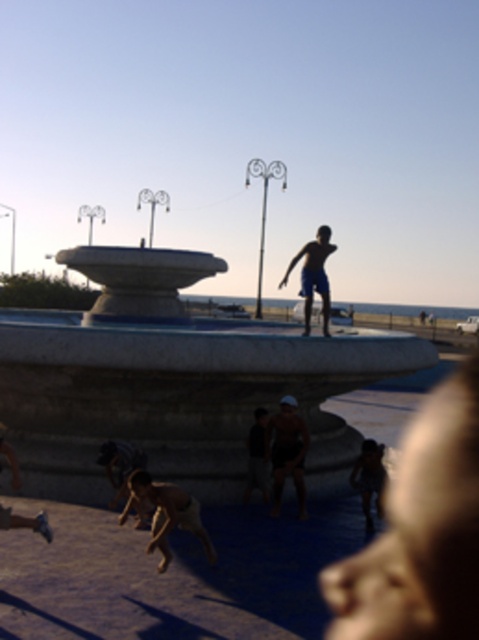
Between white marble fountain at center and dark brown leather shorts at center, which one is positioned lower?

dark brown leather shorts at center is lower down.

Locate an element on the screen. The image size is (479, 640). white marble fountain at center is located at coordinates (172, 381).

Does point (69, 388) lie in front of point (283, 413)?

No, it is not.

Where is `white marble fountain at center`? white marble fountain at center is located at coordinates (172, 381).

From the picture: Does white marble fountain at center have a lesser height compared to blue matte shorts at center?

Correct, white marble fountain at center is not as tall as blue matte shorts at center.

Can you confirm if white marble fountain at center is thinner than blue matte shorts at center?

In fact, white marble fountain at center might be wider than blue matte shorts at center.

Who is more distant from viewer, (341,476) or (319,227)?

Positioned behind is point (319,227).

In order to click on white marble fountain at center in this screenshot , I will do `click(172, 381)`.

Does dark brown leather shorts at center have a smaller size compared to blue matte shorts at center?

No, dark brown leather shorts at center is not smaller than blue matte shorts at center.

Which is in front, point (306, 516) or point (307, 266)?

Point (306, 516) is in front.

Where is `dark brown leather shorts at center`? dark brown leather shorts at center is located at coordinates (287, 451).

Image resolution: width=479 pixels, height=640 pixels. Find the location of `dark brown leather shorts at center`. dark brown leather shorts at center is located at coordinates point(287,451).